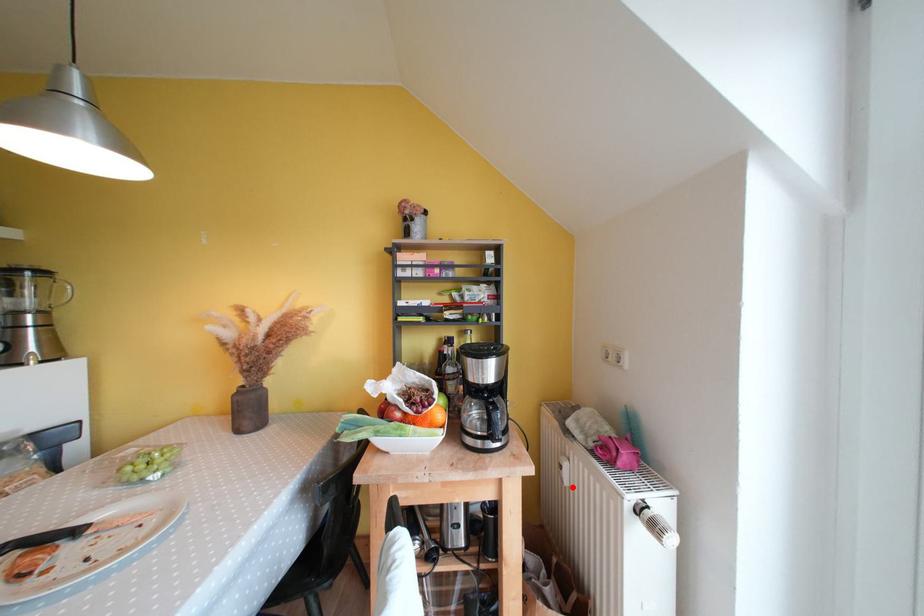
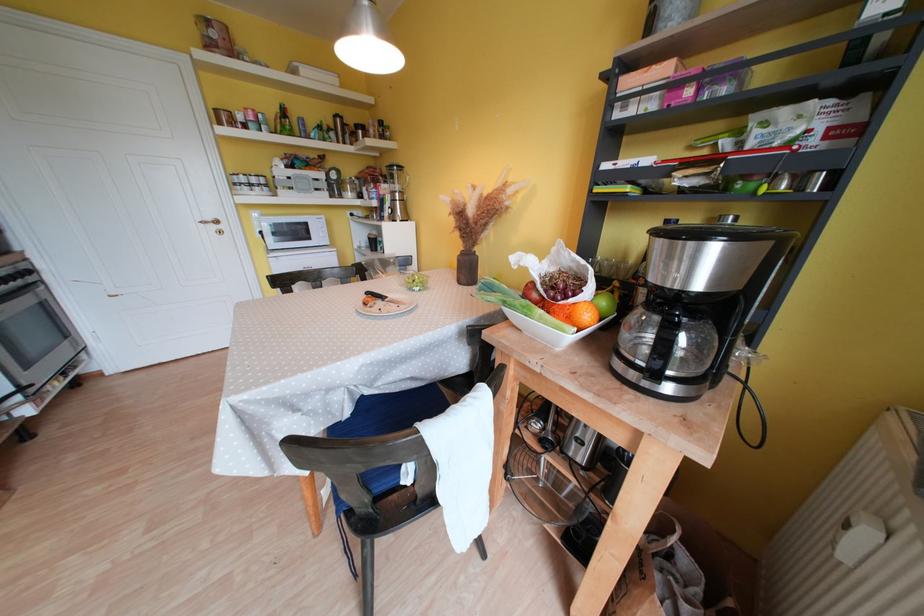
Question: I am providing you with two images of the same scene from different viewpoints. Image1 has a red point marked. In image2, the corresponding 3D location appears at what relative position? Reply with the corresponding letter.

Choices:
 (A) Closer
 (B) Farther

Answer: (B)